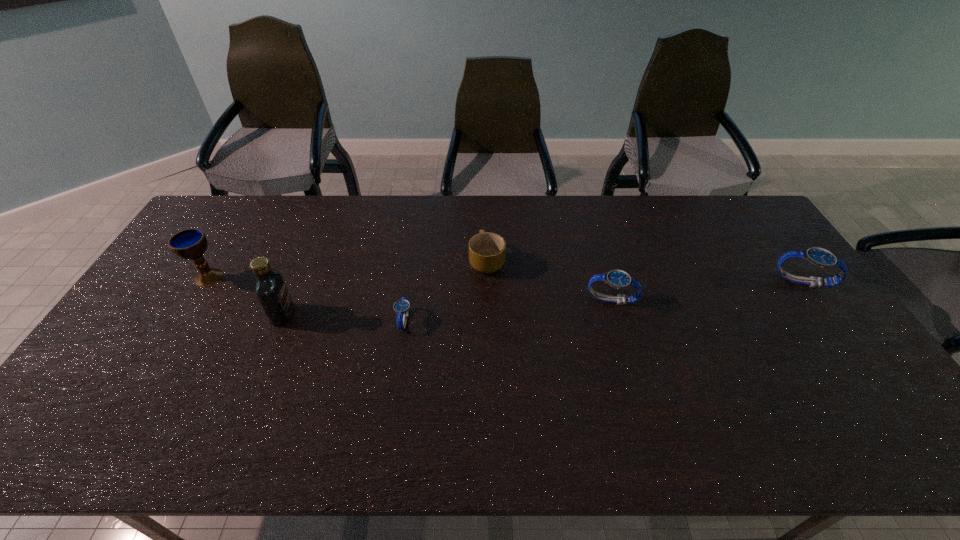
The height and width of the screenshot is (540, 960). Find the location of `vacant region between the fourth object from right to left and the tallest object`. vacant region between the fourth object from right to left and the tallest object is located at coordinates (344, 318).

Locate an element on the screen. The width and height of the screenshot is (960, 540). free point between the rightmost watch and the leftmost object is located at coordinates tap(506, 279).

Identify the location of vacant area that lies between the chalice and the rightmost object. The width and height of the screenshot is (960, 540). (506, 279).

Image resolution: width=960 pixels, height=540 pixels. I want to click on free area in between the mug and the second watch from right to left, so click(x=549, y=280).

The width and height of the screenshot is (960, 540). I want to click on unoccupied area between the leftmost object and the second object from right to left, so click(x=410, y=288).

Select which object is the second closest to the second tallest watch. Please provide its 2D coordinates. Your answer should be formatted as a tuple, i.e. [(x, y)], where the tuple contains the x and y coordinates of a point satisfying the conditions above.

[(820, 257)]

I want to click on the second closest object to the rightmost watch, so click(x=487, y=251).

This screenshot has width=960, height=540. In order to click on watch that stands as the closest to the mug in this screenshot , I will do `click(401, 307)`.

Locate an element on the screen. Image resolution: width=960 pixels, height=540 pixels. watch that can be found as the second closest to the second object from right to left is located at coordinates (401, 307).

The width and height of the screenshot is (960, 540). Identify the location of blank space that satisfies the following two spatial constraints: 1. on the back side of the leftmost watch; 2. on the left side of the second shortest watch. (408, 300).